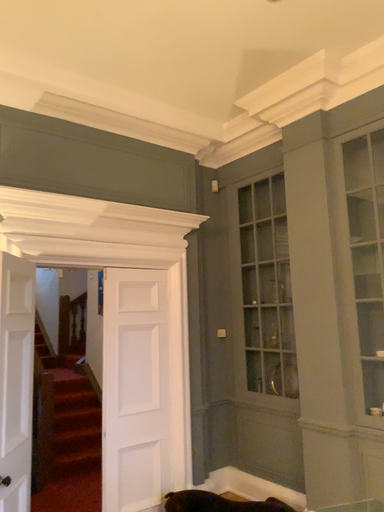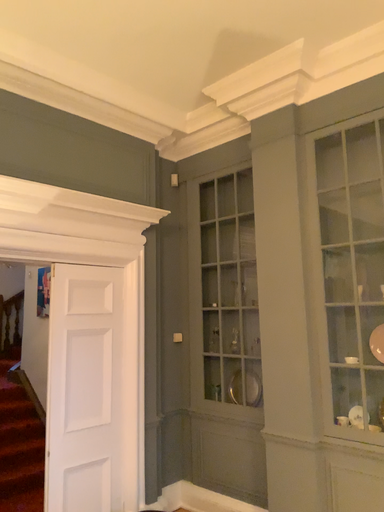
Question: Which way did the camera rotate in the video?

Choices:
 (A) rotated left
 (B) rotated right

Answer: (B)